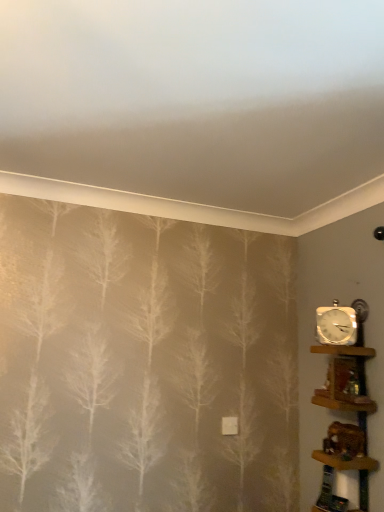
Question: Does wooden shelf at right, the 2th shelf when ordered from bottom to top, have a greater width compared to wooden shelf at right, acting as the 1th shelf starting from the bottom?

Choices:
 (A) yes
 (B) no

Answer: (B)

Question: Does wooden shelf at right, the 2th shelf when ordered from bottom to top, appear on the left side of wooden shelf at right, marked as the second shelf in a top-to-bottom arrangement?

Choices:
 (A) no
 (B) yes

Answer: (A)

Question: From a real-world perspective, is wooden shelf at right, the 2th shelf when ordered from bottom to top, located higher than wooden shelf at right, marked as the second shelf in a top-to-bottom arrangement?

Choices:
 (A) no
 (B) yes

Answer: (B)

Question: From a real-world perspective, is wooden shelf at right, the 2th shelf when ordered from bottom to top, physically below wooden shelf at right, marked as the second shelf in a top-to-bottom arrangement?

Choices:
 (A) yes
 (B) no

Answer: (B)

Question: Can you confirm if wooden shelf at right, the 2th shelf when ordered from bottom to top, is smaller than wooden shelf at right, acting as the 1th shelf starting from the bottom?

Choices:
 (A) no
 (B) yes

Answer: (B)

Question: From a real-world perspective, relative to white metallic clock at right, is wooden shelf at right, the 1th shelf in the top-to-bottom sequence, vertically above or below?

Choices:
 (A) above
 (B) below

Answer: (B)

Question: Is point (349, 351) closer or farther from the camera than point (324, 317)?

Choices:
 (A) closer
 (B) farther

Answer: (A)

Question: From their relative heights in the image, would you say wooden shelf at right, the 2th shelf when ordered from bottom to top, is taller or shorter than white metallic clock at right?

Choices:
 (A) short
 (B) tall

Answer: (A)

Question: Is wooden shelf at right, the 2th shelf when ordered from bottom to top, wider or thinner than white metallic clock at right?

Choices:
 (A) wide
 (B) thin

Answer: (A)

Question: Choose the correct answer: Is wooden shelf at right, marked as the second shelf in a top-to-bottom arrangement, inside wooden shelf at right, the 1th shelf in the top-to-bottom sequence, or outside it?

Choices:
 (A) inside
 (B) outside

Answer: (B)

Question: Is wooden shelf at right, acting as the 1th shelf starting from the bottom, taller or shorter than wooden shelf at right, the 1th shelf in the top-to-bottom sequence?

Choices:
 (A) short
 (B) tall

Answer: (B)

Question: Visually, is wooden shelf at right, acting as the 1th shelf starting from the bottom, positioned to the left or to the right of wooden shelf at right, the 1th shelf in the top-to-bottom sequence?

Choices:
 (A) right
 (B) left

Answer: (B)

Question: Is wooden shelf at right, marked as the second shelf in a top-to-bottom arrangement, bigger or smaller than wooden shelf at right, the 2th shelf when ordered from bottom to top?

Choices:
 (A) big
 (B) small

Answer: (A)

Question: Is point (370, 356) positioned closer to the camera than point (322, 321)?

Choices:
 (A) farther
 (B) closer

Answer: (B)

Question: Based on their sizes in the image, would you say wooden shelf at right, acting as the 1th shelf starting from the bottom, is bigger or smaller than white metallic clock at right?

Choices:
 (A) big
 (B) small

Answer: (A)